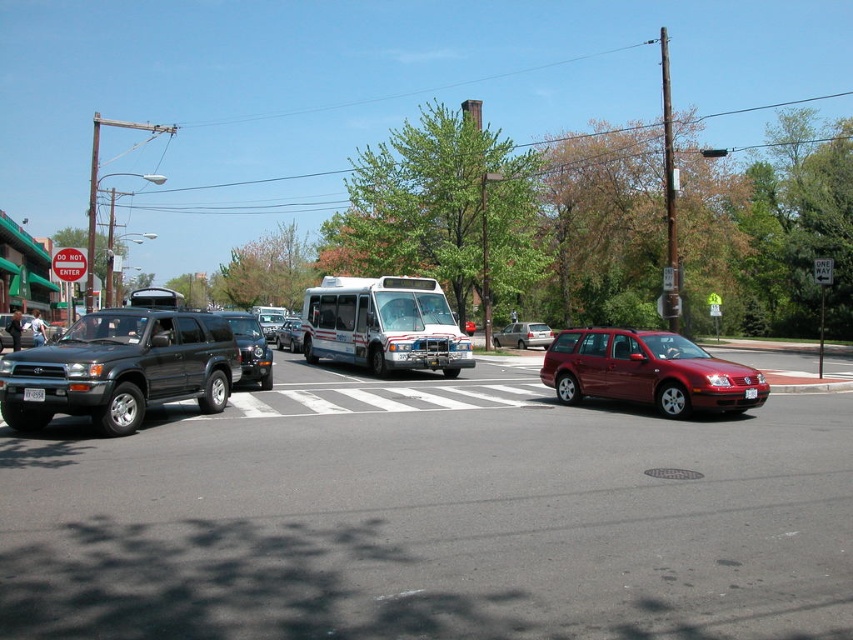
Question: Among these objects, which one is nearest to the camera?

Choices:
 (A) metallic silver suv at center
 (B) matte black suv at left
 (C) metallic red sedan at center

Answer: (B)

Question: Is white glossy bus at center to the left of white plastic license plate at center from the viewer's perspective?

Choices:
 (A) yes
 (B) no

Answer: (B)

Question: Which of these objects is positioned closest to the metallic silver suv at center?

Choices:
 (A) metallic red sedan at center
 (B) shiny metallic station wagon at center-right
 (C) white glossy bus at center
 (D) matte black suv at center

Answer: (C)

Question: Does matte black suv at center appear under metallic silver suv at center?

Choices:
 (A) yes
 (B) no

Answer: (B)

Question: Can you confirm if metallic silver suv at center is positioned above white plastic license plate at center?

Choices:
 (A) yes
 (B) no

Answer: (A)

Question: Among these points, which one is farthest from the camera?

Choices:
 (A) (239, 330)
 (B) (293, 330)
 (C) (28, 397)
 (D) (0, 392)

Answer: (B)